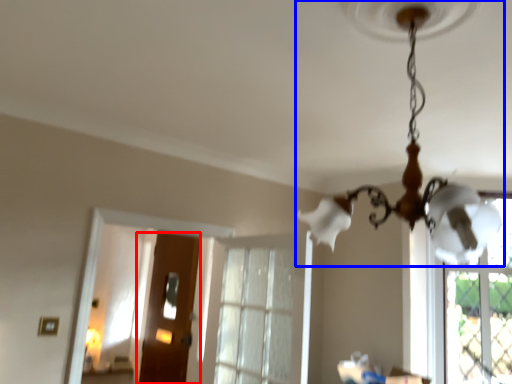
Question: Which of the following is the farthest to the observer, door (highlighted by a red box) or lamp (highlighted by a blue box)?

Choices:
 (A) door
 (B) lamp

Answer: (A)